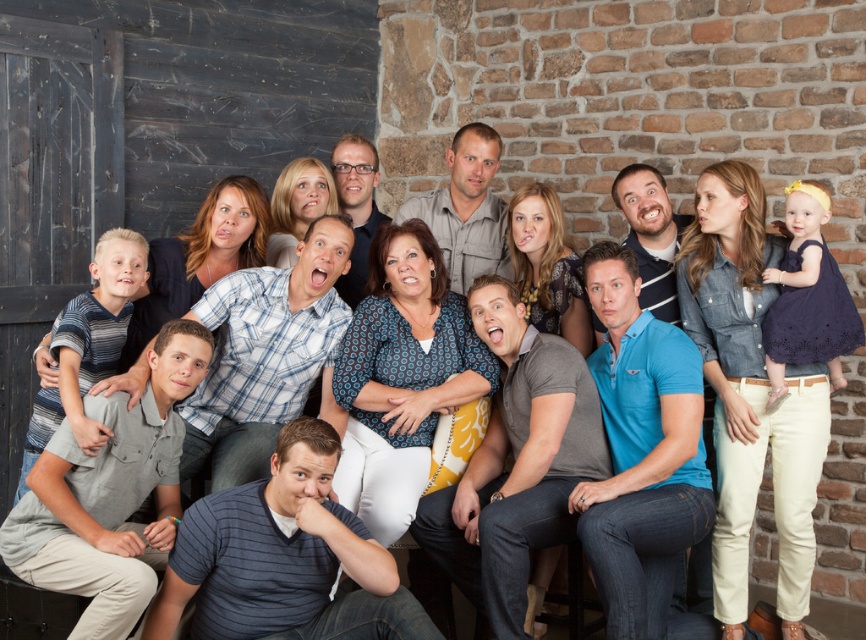
Question: Which point is farther to the camera?

Choices:
 (A) light brown shirt at center
 (B) matte blue shirt at center

Answer: (A)

Question: Is light brown shirt at center thinner than matte blue shirt at center?

Choices:
 (A) yes
 (B) no

Answer: (B)

Question: Does light brown shirt at center appear under matte blue shirt at center?

Choices:
 (A) yes
 (B) no

Answer: (B)

Question: Considering the relative positions of light brown shirt at center and matte blue shirt at center in the image provided, where is light brown shirt at center located with respect to matte blue shirt at center?

Choices:
 (A) right
 (B) left

Answer: (B)

Question: Among these points, which one is nearest to the camera?

Choices:
 (A) (661, 246)
 (B) (451, 202)

Answer: (A)

Question: Which point appears closest to the camera in this image?

Choices:
 (A) (477, 227)
 (B) (643, 211)

Answer: (B)